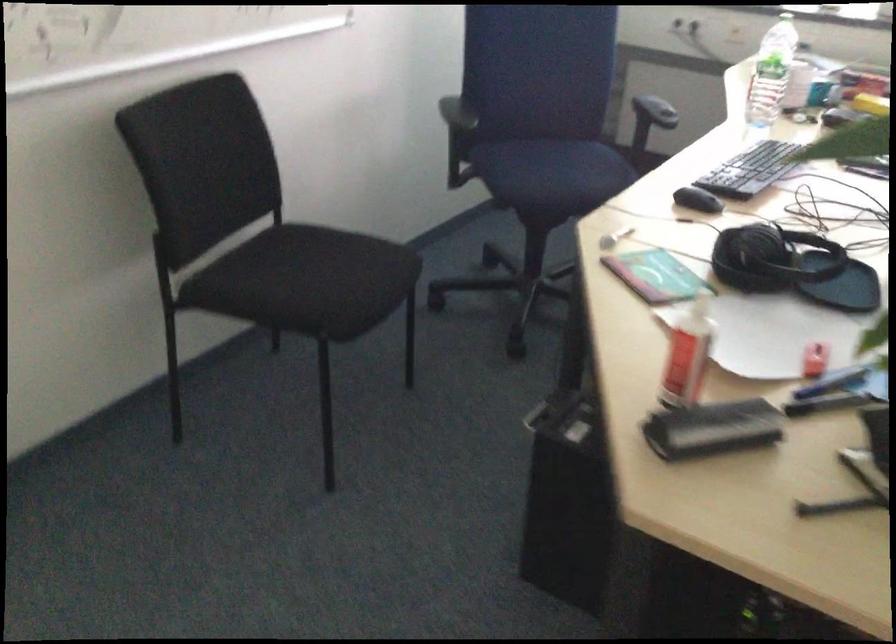
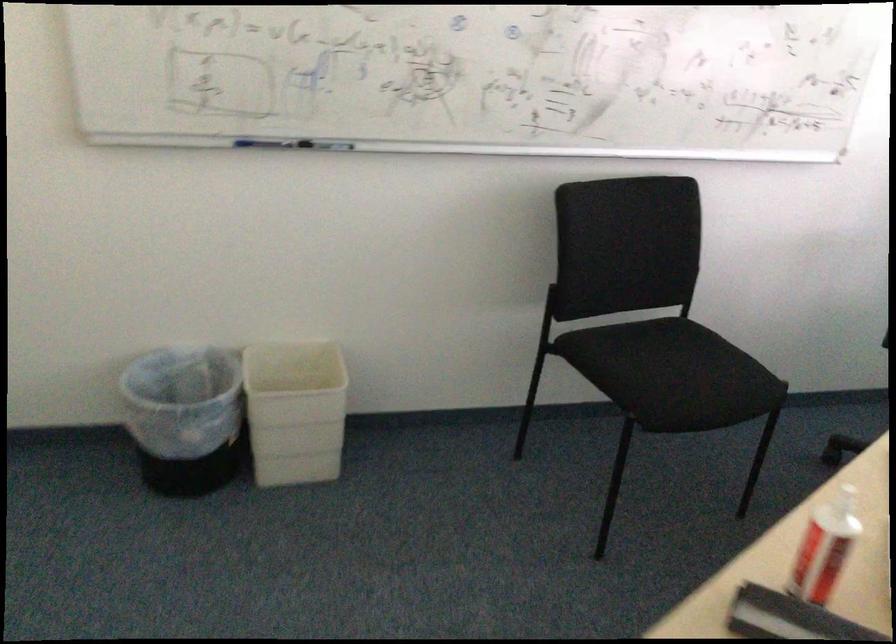
Locate, in the second image, the point that corresponds to point (346, 279) in the first image.

(688, 379)